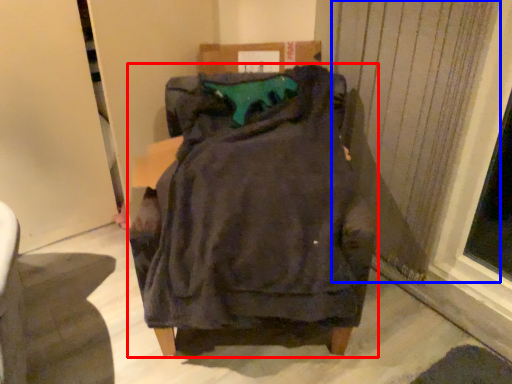
Question: Which object is further to the camera taking this photo, furniture (highlighted by a red box) or curtain (highlighted by a blue box)?

Choices:
 (A) furniture
 (B) curtain

Answer: (B)